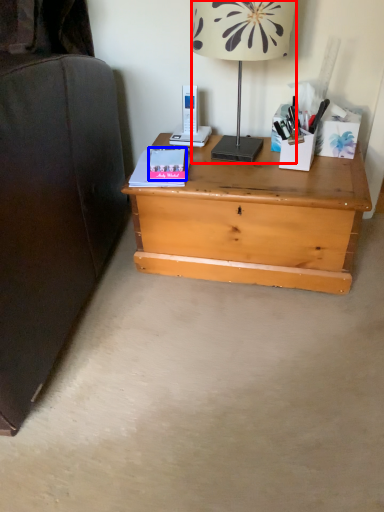
Question: Which object appears closest to the camera in this image, lamp (highlighted by a red box) or paperback book (highlighted by a blue box)?

Choices:
 (A) lamp
 (B) paperback book

Answer: (A)